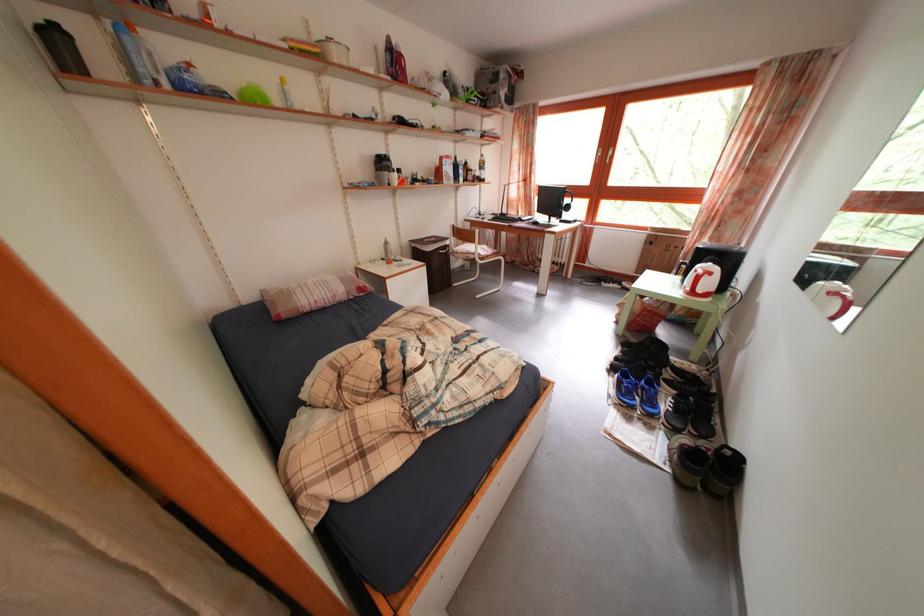
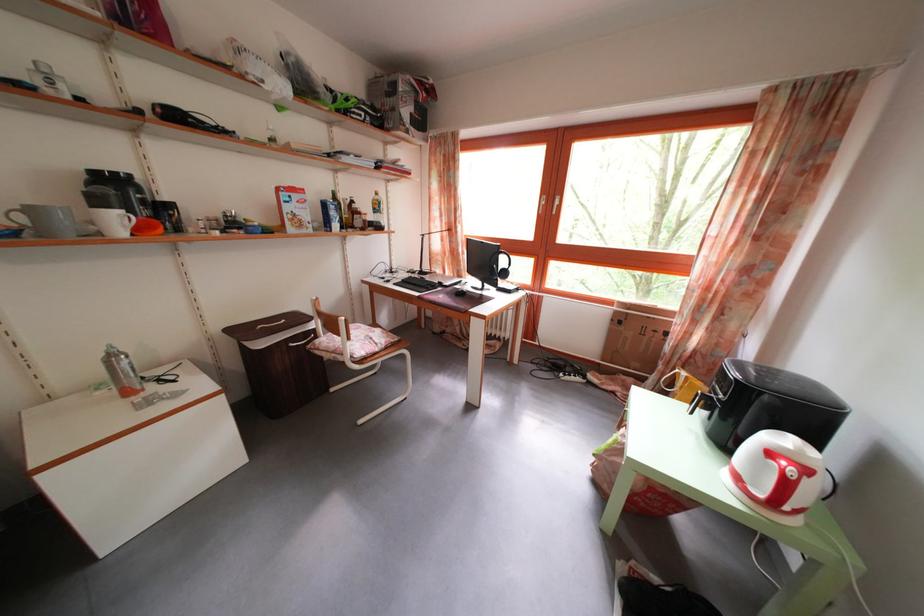
Where in the second image is the point corresponding to point 456,253 from the first image?

(322, 339)